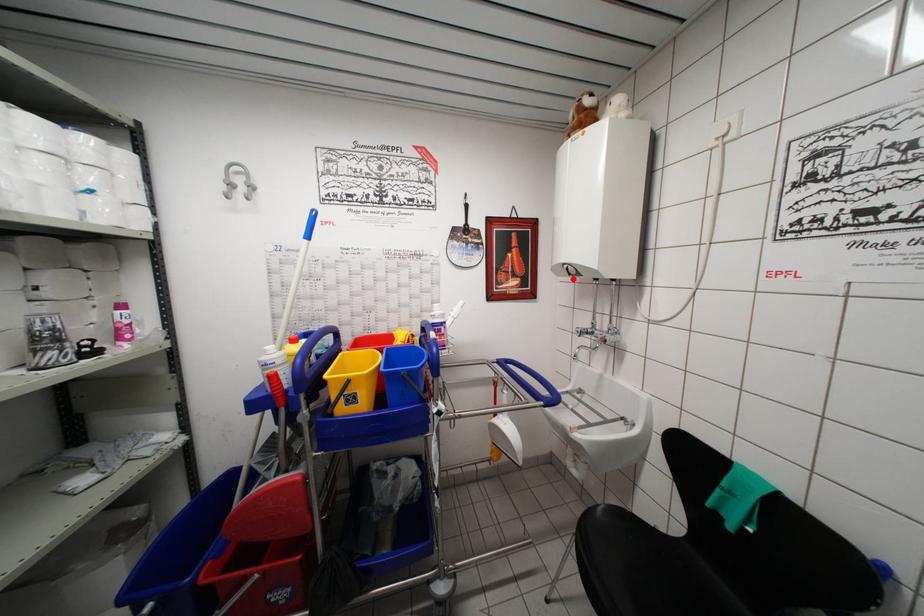
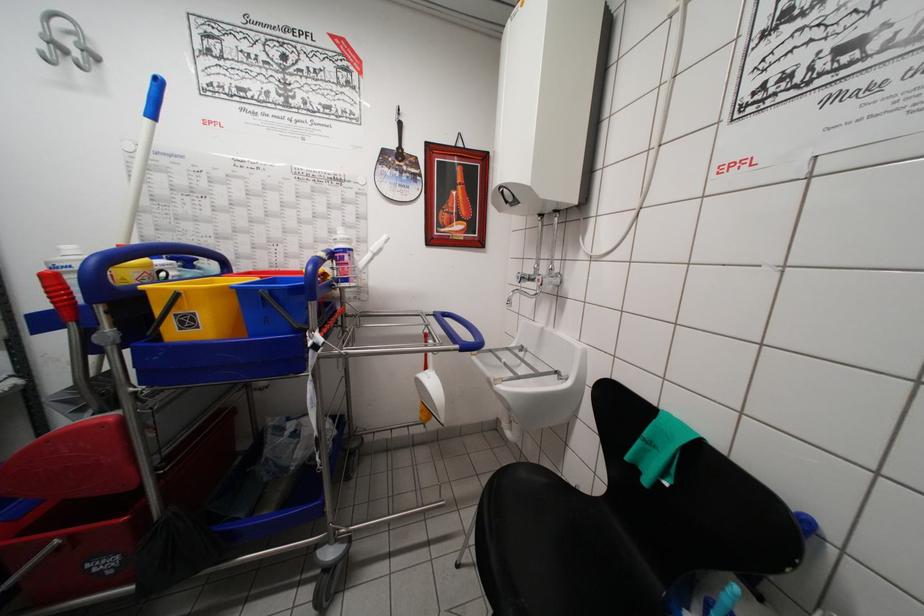
Question: I am providing you with two images of the same scene from different viewpoints. A red point is marked on the first image. Is the red point's position out of view in image 2?

Choices:
 (A) Yes
 (B) No

Answer: (B)